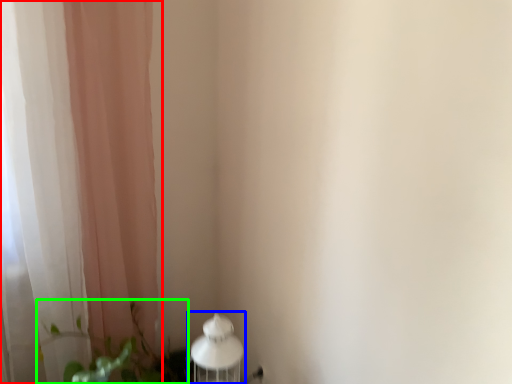
Question: Considering the real-world distances, which object is closest to curtain (highlighted by a red box)? table lamp (highlighted by a blue box) or plant (highlighted by a green box).

Choices:
 (A) table lamp
 (B) plant

Answer: (B)